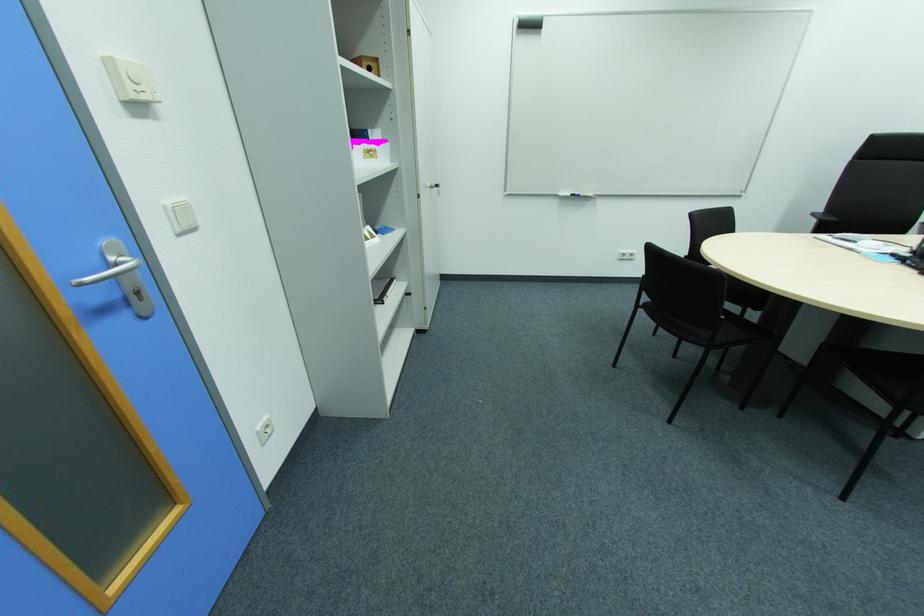
I want to click on metal door handle, so click(108, 272).